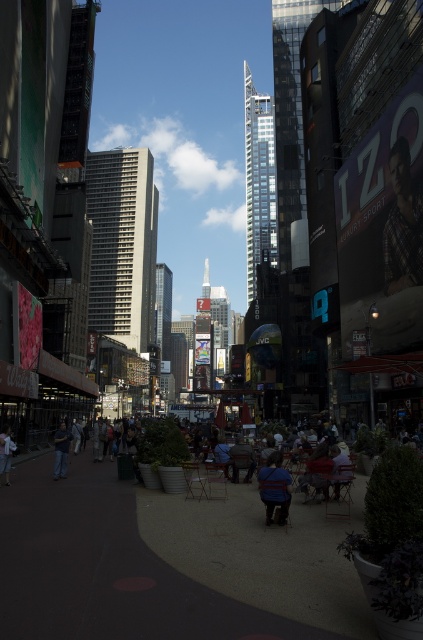
Question: Among these points, which one is nearest to the camera?

Choices:
 (A) (5, 476)
 (B) (129, 188)
 (C) (156, 321)
 (D) (275, 506)

Answer: (D)

Question: Among these objects, which one is nearest to the camera?

Choices:
 (A) denim jeans at left
 (B) light blue denim jeans at lower left

Answer: (B)

Question: Does gray concrete building at center appear on the left side of denim jeans at left?

Choices:
 (A) no
 (B) yes

Answer: (B)

Question: Can you confirm if glassy steel tower at center is positioned above blue fabric shirt at center?

Choices:
 (A) yes
 (B) no

Answer: (A)

Question: Is blue fabric shirt at center to the left of denim jeans at left from the viewer's perspective?

Choices:
 (A) yes
 (B) no

Answer: (B)

Question: Which object is closer to the camera taking this photo?

Choices:
 (A) gray concrete building at center
 (B) glassy steel tower at center
 (C) light blue denim jeans at lower left

Answer: (C)